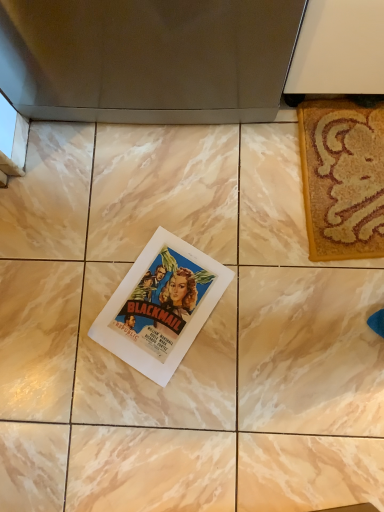
Locate an element on the screen. free space to the left of white paper at center is located at coordinates (67, 324).